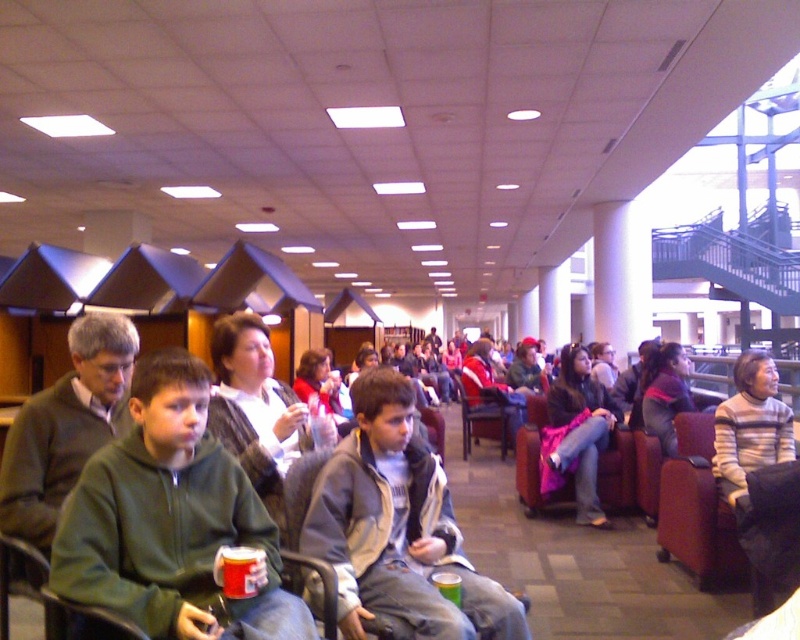
From the picture: You are organizing a seating arrangement and need to know which of the two jackets takes up more space. Which one is larger between the green fleece jacket at center and the gray fleece jacket at center?

The gray fleece jacket at center is larger because it occupies more space than the green fleece jacket at center.